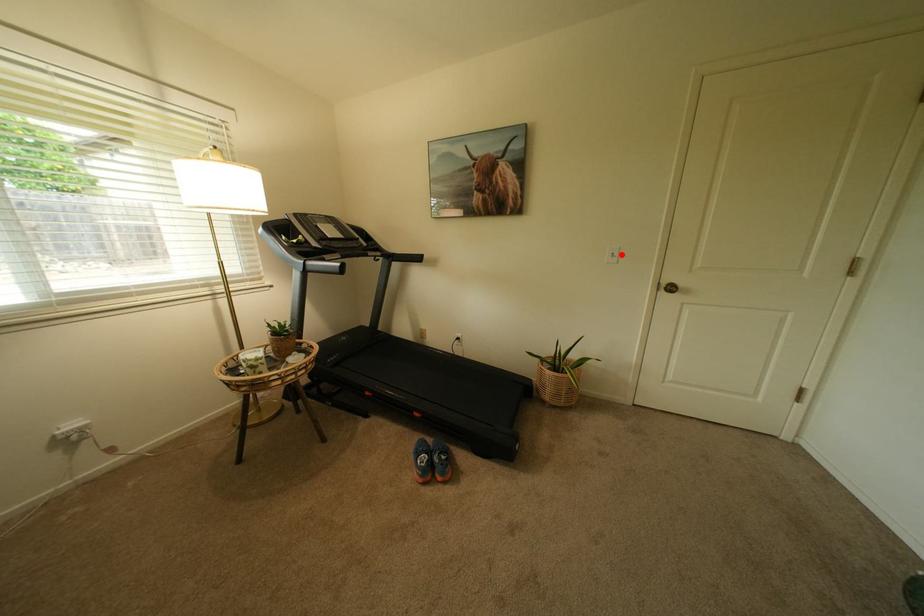
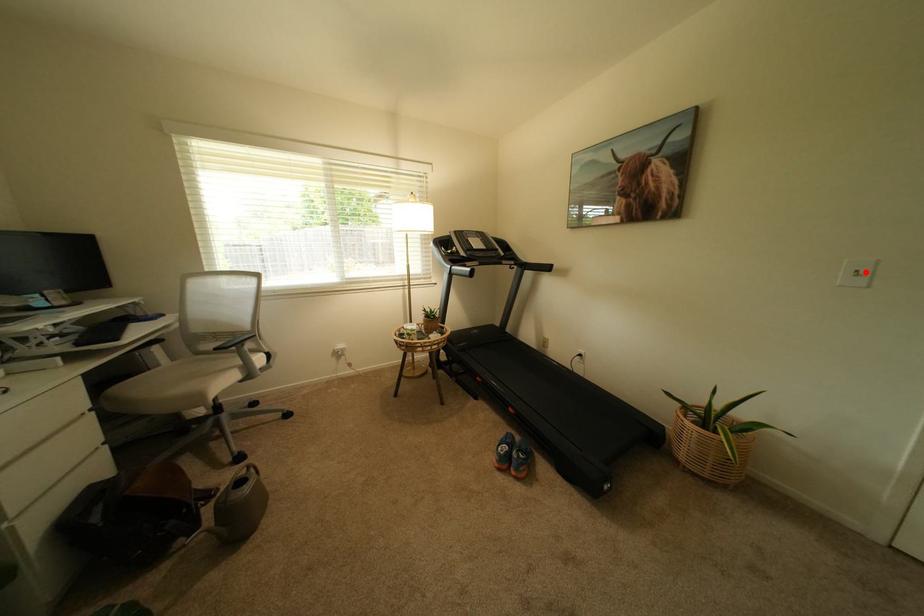
I am providing you with two images of the same scene from different viewpoints. A red point is marked on the first image and another point is marked on the second image. Does the point marked in image1 correspond to the same location as the one in image2?

Yes